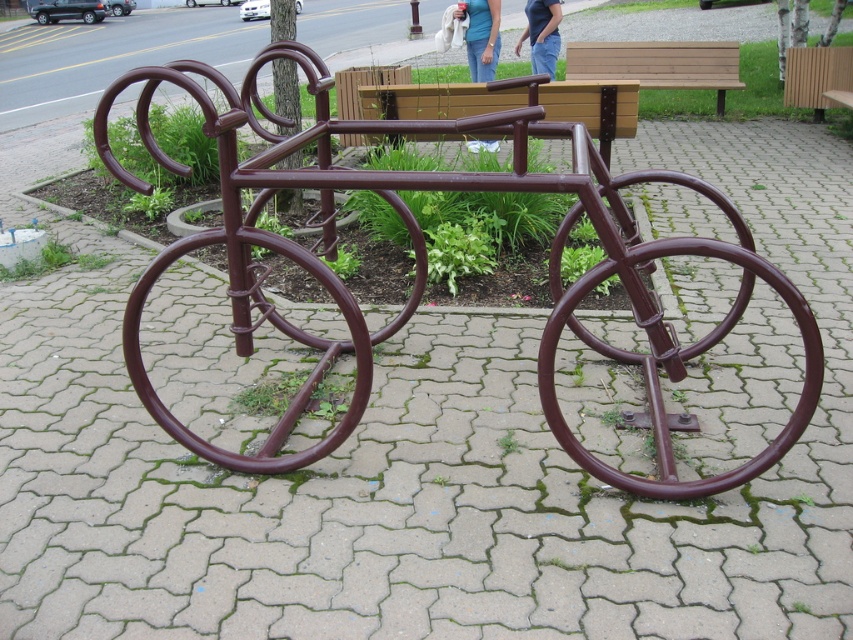
You are a photographer setting up a shot of the bicycle rack. You want to ensure both the brown metallic bicycle at center and the blue denim jeans at center are in frame. Which object should you focus on first to capture both in the shot?

You should focus on the blue denim jeans at center first because the brown metallic bicycle at center is located below it, ensuring both will be in the frame when starting from the higher position.

You are a delivery person trying to park your brown metallic bicycle at center in a space that can only accommodate items narrower than the blue denim jeans at center. Can you park your bicycle there?

The brown metallic bicycle at center might be wider than blue denim jeans at center, so it might not fit in the space designed for narrower items.

You are standing at the entrance of the public space and want to sit down. You see the brown wood bench at center and the blue jeans at upper center. Which object is closer to your right side?

The blue jeans at upper center is to the right of the brown wood bench at center, so the blue jeans at upper center is closer to your right side.